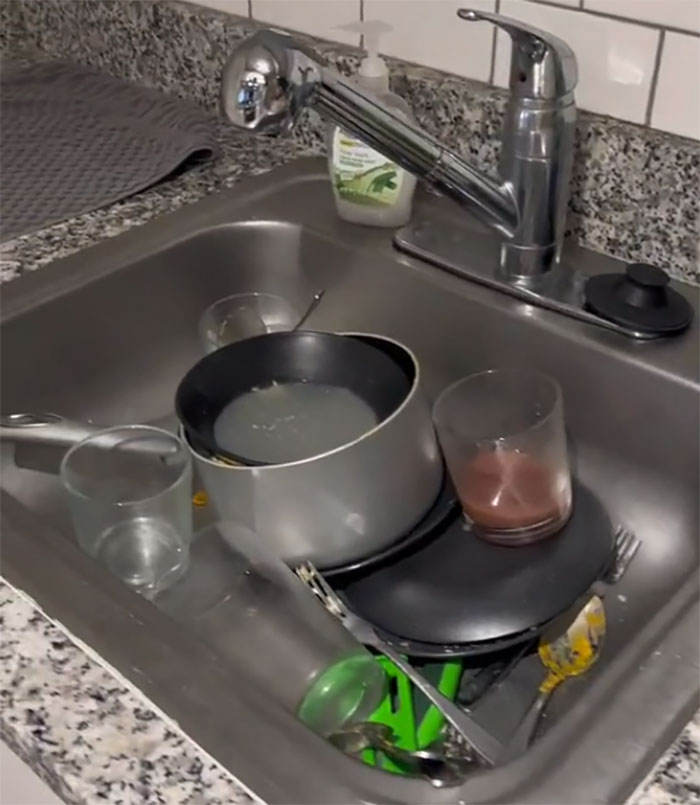
Where is `countertop`? countertop is located at coordinates (174, 44), (75, 704).